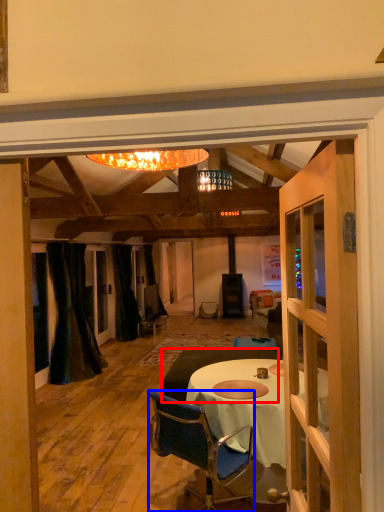
Question: Among these objects, which one is nearest to the camera, studio couch (highlighted by a red box) or chair (highlighted by a blue box)?

Choices:
 (A) studio couch
 (B) chair

Answer: (B)